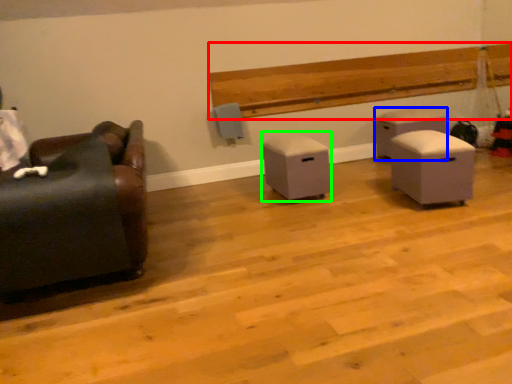
Question: Which is farther away from hardwood (highlighted by a red box)? furniture (highlighted by a blue box) or furniture (highlighted by a green box)?

Choices:
 (A) furniture
 (B) furniture

Answer: (B)